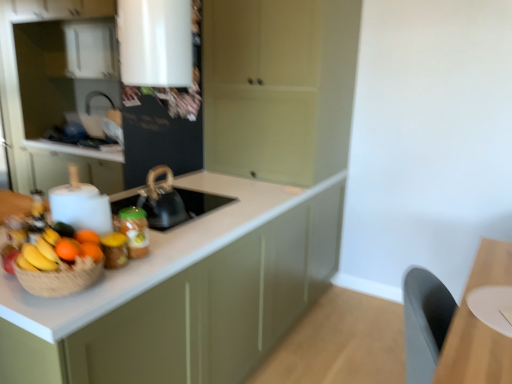
Identify the location of free space in front of orange matte at left, the 2th orange when ordered from front to back. (73, 292).